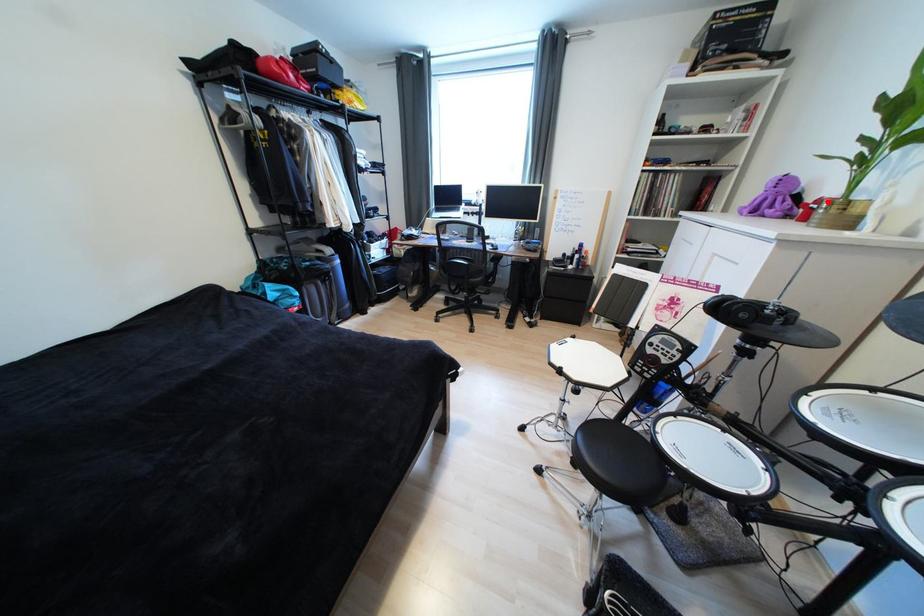
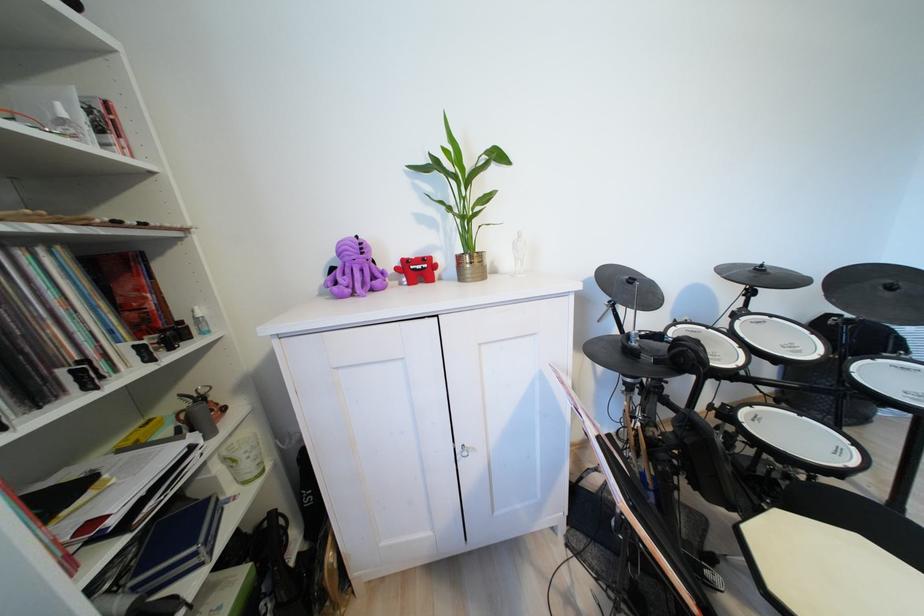
Locate, in the second image, the point that corresponds to the highlighted location in the first image.

(411, 262)